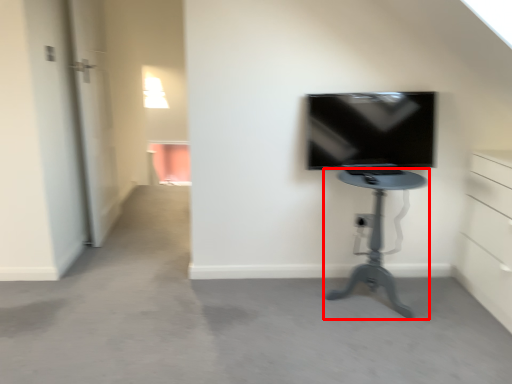
Question: From the image's perspective, where is furniture (annotated by the red box) located in relation to television in the image?

Choices:
 (A) above
 (B) below

Answer: (B)